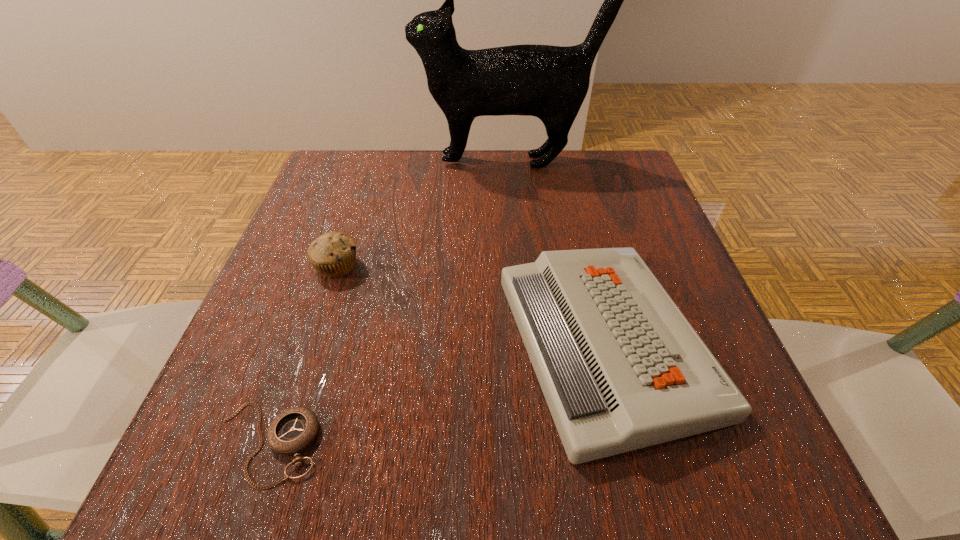
This screenshot has width=960, height=540. In order to click on the tallest object in this screenshot , I will do `click(550, 82)`.

Locate an element on the screen. the farthest object is located at coordinates (550, 82).

The image size is (960, 540). In order to click on muffin in this screenshot , I will do `click(333, 254)`.

In order to click on computer keyboard in this screenshot , I will do `click(621, 368)`.

The height and width of the screenshot is (540, 960). In order to click on pocket watch in this screenshot , I will do (x=293, y=430).

Find the location of a particular element. free region located 0.130m on the face of the cat is located at coordinates (366, 161).

Find the location of a particular element. The height and width of the screenshot is (540, 960). free point located 0.260m on the front of the muffin is located at coordinates (287, 417).

Where is `vacant space located 0.400m on the back of the computer keyboard`? The width and height of the screenshot is (960, 540). vacant space located 0.400m on the back of the computer keyboard is located at coordinates (559, 153).

The image size is (960, 540). Identify the location of free space located 0.280m on the back of the shortest object. (329, 266).

The width and height of the screenshot is (960, 540). I want to click on object located at the far edge, so click(550, 82).